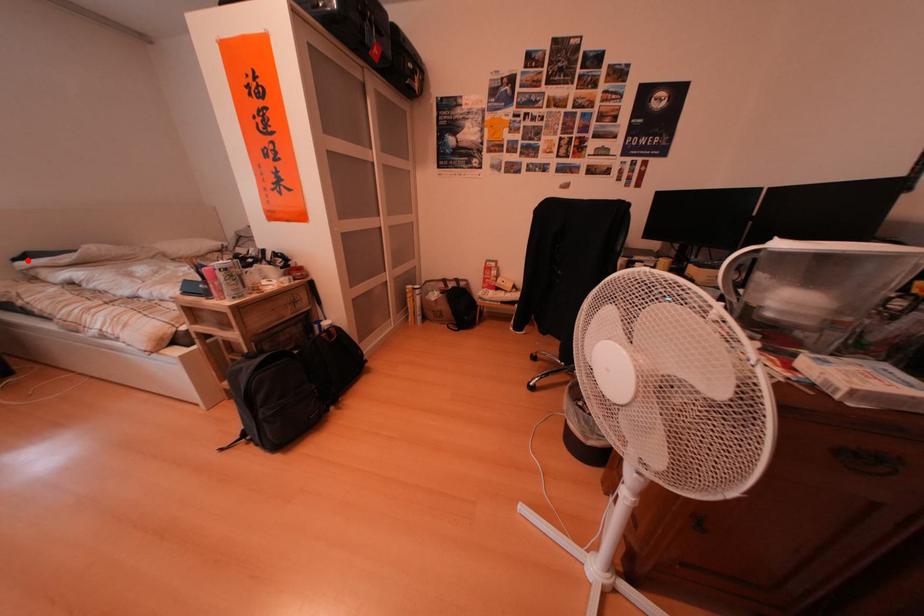
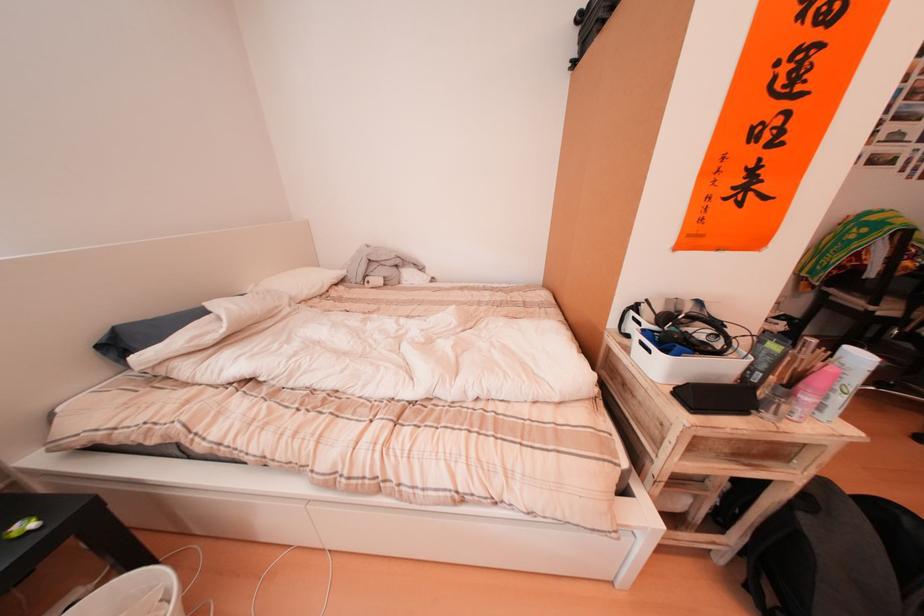
Question: I am providing you with two images of the same scene from different viewpoints. A red point is shown in image1. For the corresponding object point in image2, is it positioned nearer or farther from the camera?

Choices:
 (A) Nearer
 (B) Farther

Answer: (A)